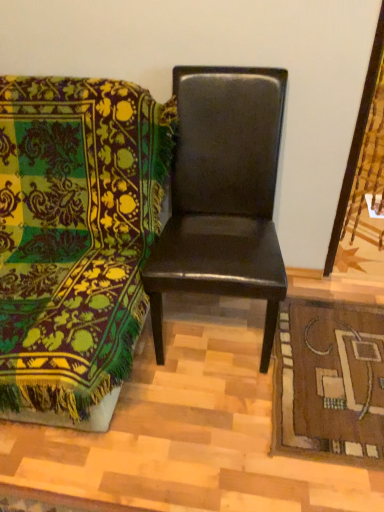
Question: Is brown woven mat at lower right behind matte black chair at center, the second chair from the right?

Choices:
 (A) yes
 (B) no

Answer: (A)

Question: Considering the relative sizes of brown woven mat at lower right and matte black chair at center, positioned as the 1th chair in left-to-right order, in the image provided, is brown woven mat at lower right taller than matte black chair at center, positioned as the 1th chair in left-to-right order,?

Choices:
 (A) yes
 (B) no

Answer: (B)

Question: Is brown woven mat at lower right at the right side of matte black chair at center, the second chair from the right?

Choices:
 (A) yes
 (B) no

Answer: (A)

Question: Considering the relative positions of brown woven mat at lower right and matte black chair at center, positioned as the 1th chair in left-to-right order, in the image provided, is brown woven mat at lower right in front of matte black chair at center, positioned as the 1th chair in left-to-right order,?

Choices:
 (A) no
 (B) yes

Answer: (A)

Question: Does brown woven mat at lower right appear on the left side of matte black chair at center, the second chair from the right?

Choices:
 (A) yes
 (B) no

Answer: (B)

Question: Would you say matte black chair at center, positioned as the 1th chair in left-to-right order, is inside or outside brown woven mat at lower right?

Choices:
 (A) outside
 (B) inside

Answer: (A)

Question: In the image, is matte black chair at center, the second chair from the right, on the left side or the right side of brown woven mat at lower right?

Choices:
 (A) left
 (B) right

Answer: (A)

Question: Is matte black chair at center, positioned as the 1th chair in left-to-right order, wider or thinner than brown woven mat at lower right?

Choices:
 (A) wide
 (B) thin

Answer: (A)

Question: From their relative heights in the image, would you say matte black chair at center, the second chair from the right, is taller or shorter than brown woven mat at lower right?

Choices:
 (A) tall
 (B) short

Answer: (A)

Question: From their relative heights in the image, would you say glossy black chair at center, the first chair positioned from the right, is taller or shorter than matte black chair at center, the second chair from the right?

Choices:
 (A) tall
 (B) short

Answer: (A)

Question: Relative to matte black chair at center, the second chair from the right, is glossy black chair at center, the first chair positioned from the right, in front or behind?

Choices:
 (A) behind
 (B) front

Answer: (A)

Question: Considering the positions of glossy black chair at center, which is the second chair in left-to-right order, and matte black chair at center, positioned as the 1th chair in left-to-right order, in the image, is glossy black chair at center, which is the second chair in left-to-right order, wider or thinner than matte black chair at center, positioned as the 1th chair in left-to-right order,?

Choices:
 (A) wide
 (B) thin

Answer: (B)

Question: In the image, is glossy black chair at center, the first chair positioned from the right, on the left side or the right side of matte black chair at center, the second chair from the right?

Choices:
 (A) right
 (B) left

Answer: (A)

Question: Relative to matte black chair at center, the second chair from the right, is brown woven mat at lower right in front or behind?

Choices:
 (A) behind
 (B) front

Answer: (A)

Question: Is brown woven mat at lower right situated inside matte black chair at center, positioned as the 1th chair in left-to-right order, or outside?

Choices:
 (A) outside
 (B) inside

Answer: (A)